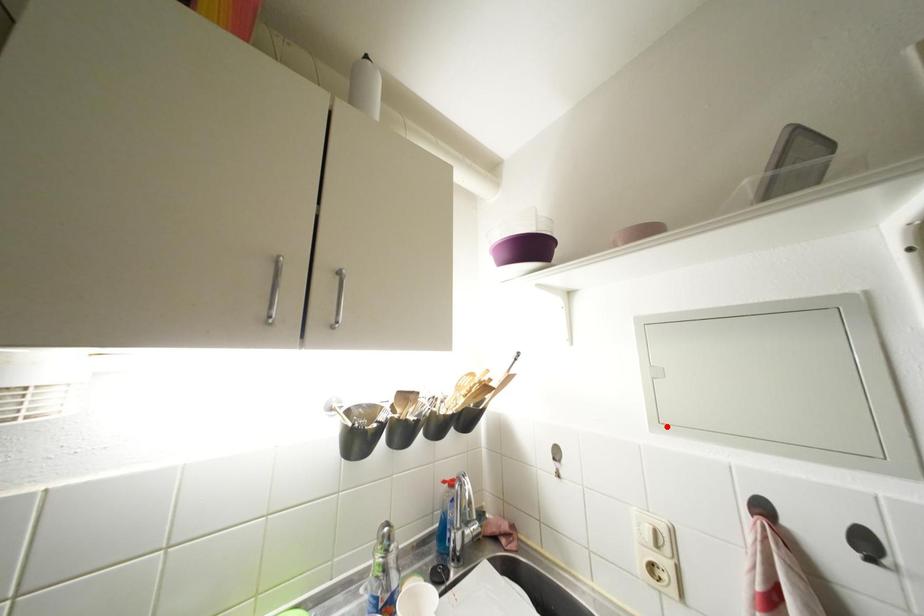
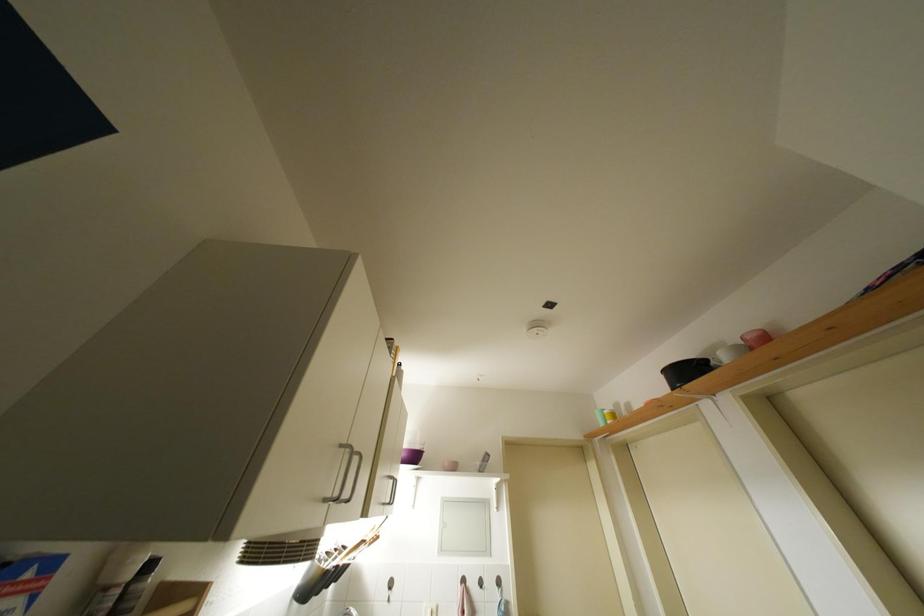
Where in the second image is the point corresponding to the highlighted location from the first image?

(447, 554)